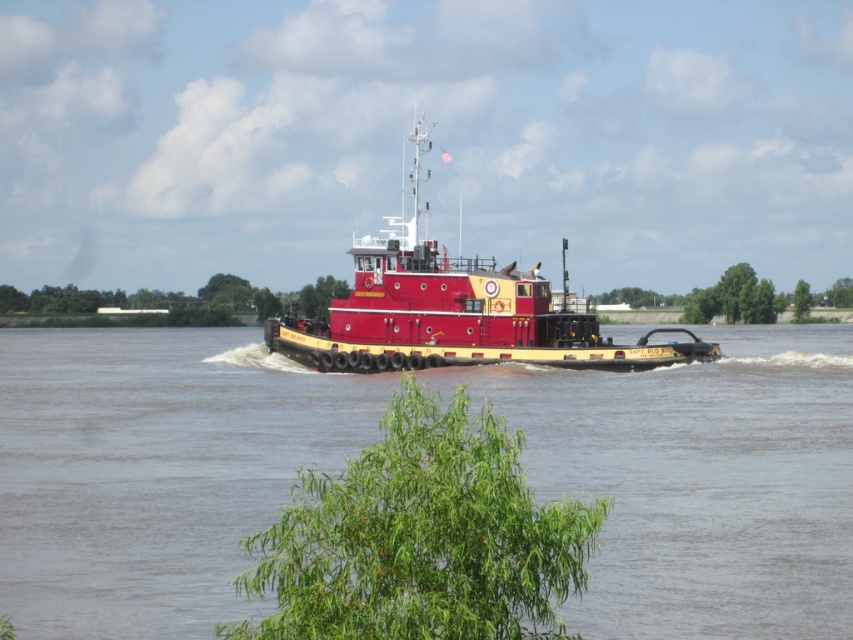
Question: Can you confirm if brown matte river at center is bigger than green leafy tree at center?

Choices:
 (A) yes
 (B) no

Answer: (A)

Question: Which point appears closest to the camera in this image?

Choices:
 (A) (529, 442)
 (B) (735, 282)
 (C) (492, 332)

Answer: (A)

Question: Is shiny red tugboat at center above green leafy tree at center?

Choices:
 (A) yes
 (B) no

Answer: (A)

Question: Which is nearer to the shiny red tugboat at center?

Choices:
 (A) brown matte river at center
 (B) green leafy tree at lower center
 (C) green leafy tree at upper right

Answer: (A)

Question: Can you confirm if brown matte river at center is positioned to the right of shiny red tugboat at center?

Choices:
 (A) no
 (B) yes

Answer: (A)

Question: Which point is closer to the camera?

Choices:
 (A) (801, 301)
 (B) (717, 307)
 (C) (71, 611)

Answer: (C)